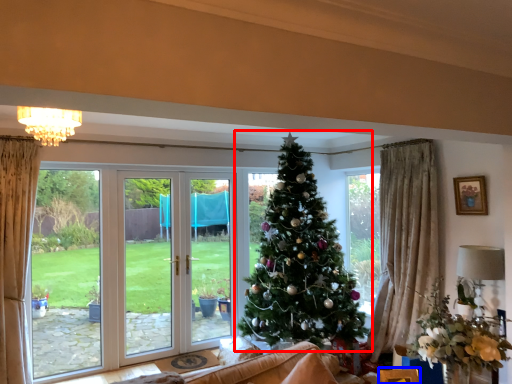
Question: Which object appears closest to the camera in this image, christmas tree (highlighted by a red box) or furniture (highlighted by a blue box)?

Choices:
 (A) christmas tree
 (B) furniture

Answer: (B)